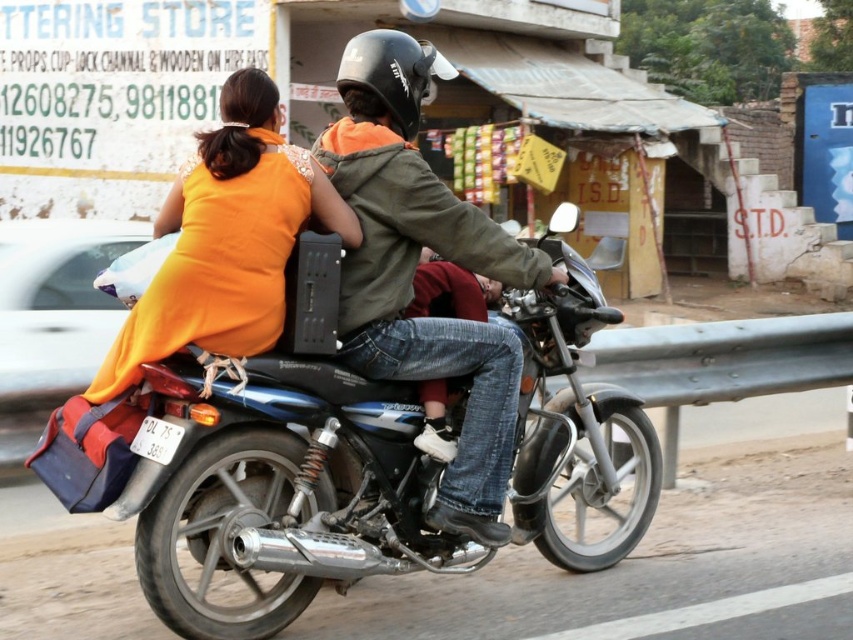
You are a delivery person who needs to deliver a package to a shop located at coordinates 0.762, 0.325. You are currently on the shiny metallic motorcycle at center. Can you reach the shop directly from your current position?

The shiny metallic motorcycle at center is located at point (276, 486), so yes, you are already at the shop location.

You are a pedestrian standing at the roadside. You see the green matte jacket at center and the orange fabric dress at upper left. Which one is higher up from the ground?

The orange fabric dress at upper left is higher up from the ground than the green matte jacket at center.

You are a pedestrian standing at the camera position. You see the shiny metallic motorcycle at center. Can you safely walk towards it without stepping into the road?

The shiny metallic motorcycle at center is 3.77 meters away from camera. Since the road is likely between you and the motorcycle, you should not walk into the road to reach it. Find a sidewalk or designated crossing instead.